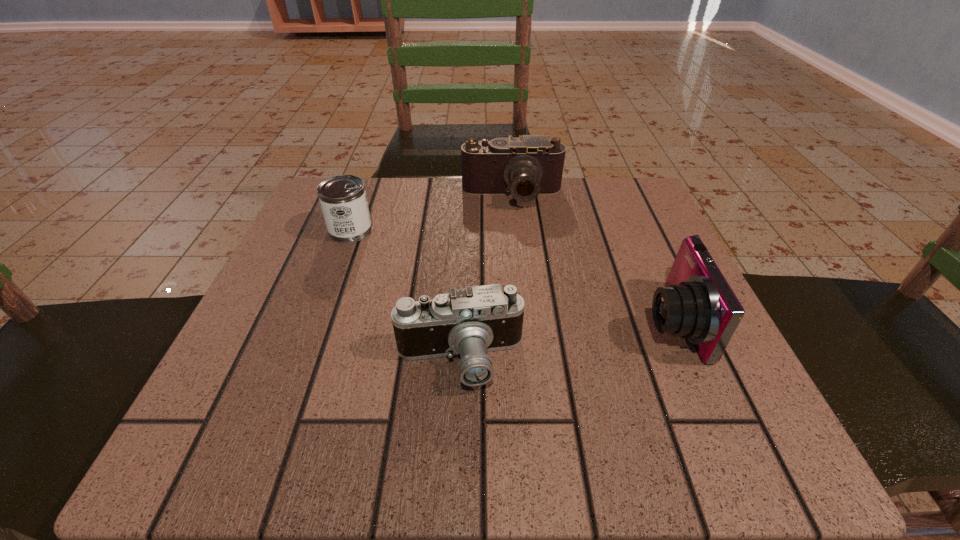
I want to click on free space between the farthest object and the rightmost camera, so (x=591, y=258).

The height and width of the screenshot is (540, 960). I want to click on blank region between the rightmost camera and the farthest camera, so click(x=591, y=258).

The width and height of the screenshot is (960, 540). Identify the location of vacant space in between the third nearest object and the rightmost object. (511, 276).

Image resolution: width=960 pixels, height=540 pixels. In order to click on unoccupied area between the second farthest object and the rightmost object in this screenshot , I will do `click(511, 276)`.

Locate an element on the screen. This screenshot has width=960, height=540. vacant space that is in between the rightmost camera and the leftmost object is located at coordinates (511, 276).

Choose which object is the second nearest neighbor to the rightmost object. Please provide its 2D coordinates. Your answer should be formatted as a tuple, i.e. [(x, y)], where the tuple contains the x and y coordinates of a point satisfying the conditions above.

[(526, 166)]

The image size is (960, 540). Identify the location of the third closest object to the leftmost object. (698, 304).

Choose which camera is the second nearest neighbor to the farthest camera. Please provide its 2D coordinates. Your answer should be formatted as a tuple, i.e. [(x, y)], where the tuple contains the x and y coordinates of a point satisfying the conditions above.

[(469, 322)]

Identify which camera is located as the second nearest to the farthest camera. Please provide its 2D coordinates. Your answer should be formatted as a tuple, i.e. [(x, y)], where the tuple contains the x and y coordinates of a point satisfying the conditions above.

[(469, 322)]